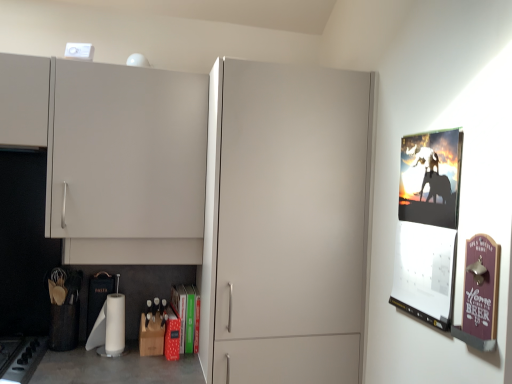
What is the approximate height of matte white cabinet at upper left?

matte white cabinet at upper left is 28.83 inches in height.

What do you see at coordinates (113, 156) in the screenshot? I see `matte white cabinet at upper left` at bounding box center [113, 156].

Identify the location of silhouette paper poster at right, acting as the second poster page starting from the front. The image size is (512, 384). (428, 225).

From the picture: What is the approximate height of silhouette paper poster at right, positioned as the 1th poster page in back-to-front order?

silhouette paper poster at right, positioned as the 1th poster page in back-to-front order, is 62.15 centimeters in height.

Looking at this image, measure the distance between white matte toilet paper at lower center and camera.

white matte toilet paper at lower center and camera are 1.78 meters apart from each other.

Locate an element on the screen. matte white cabinet at center is located at coordinates (289, 223).

From the picture: Considering the relative sizes of matte white cabinet at center and white matte toilet paper at lower center in the image provided, is matte white cabinet at center bigger than white matte toilet paper at lower center?

Yes, matte white cabinet at center is bigger than white matte toilet paper at lower center.

Based on the photo, which object is wider, matte white cabinet at center or white matte toilet paper at lower center?

Wider between the two is matte white cabinet at center.

Considering the positions of objects matte white cabinet at center and white matte toilet paper at lower center in the image provided, who is behind, matte white cabinet at center or white matte toilet paper at lower center?

white matte toilet paper at lower center is further away from the camera.

The width and height of the screenshot is (512, 384). In order to click on toilet paper directly beneath the matte white cabinet at center (from a real-world perspective) in this screenshot , I will do `click(109, 327)`.

From the image's perspective, which is above, purple wood sign at right, which is the second poster page from back to front, or matte white cabinet at upper left?

matte white cabinet at upper left is shown above in the image.

Between purple wood sign at right, which is the second poster page from back to front, and matte white cabinet at upper left, which one is positioned in front?

purple wood sign at right, which is the second poster page from back to front.

Looking at this image, which object is positioned more to the left, purple wood sign at right, which is the second poster page from back to front, or matte white cabinet at upper left?

From the viewer's perspective, matte white cabinet at upper left appears more on the left side.

Considering the sizes of objects purple wood sign at right, which is the second poster page from back to front, and matte white cabinet at upper left in the image provided, who is bigger, purple wood sign at right, which is the second poster page from back to front, or matte white cabinet at upper left?

Bigger between the two is matte white cabinet at upper left.

Is black matte gas stove at lower left closer to the viewer compared to silhouette paper poster at right, positioned as the 1th poster page in back-to-front order?

No, black matte gas stove at lower left is behind silhouette paper poster at right, positioned as the 1th poster page in back-to-front order.

Looking at their sizes, would you say black matte gas stove at lower left is wider or thinner than silhouette paper poster at right, acting as the second poster page starting from the front?

Clearly, black matte gas stove at lower left has more width compared to silhouette paper poster at right, acting as the second poster page starting from the front.

Looking at this image, considering the sizes of black matte gas stove at lower left and silhouette paper poster at right, positioned as the 1th poster page in back-to-front order, in the image, is black matte gas stove at lower left taller or shorter than silhouette paper poster at right, positioned as the 1th poster page in back-to-front order,?

Considering their sizes, black matte gas stove at lower left has less height than silhouette paper poster at right, positioned as the 1th poster page in back-to-front order.

Based on their positions, is black matte gas stove at lower left located to the left or right of silhouette paper poster at right, acting as the second poster page starting from the front?

From the image, it's evident that black matte gas stove at lower left is to the left of silhouette paper poster at right, acting as the second poster page starting from the front.

Can you tell me how much purple wood sign at right, the first poster page viewed from the front, and white matte toilet paper at lower center differ in facing direction?

The angular difference between purple wood sign at right, the first poster page viewed from the front, and white matte toilet paper at lower center is 88.7 degrees.

Is purple wood sign at right, which is the second poster page from back to front, turned away from white matte toilet paper at lower center?

No, white matte toilet paper at lower center is not at the back of purple wood sign at right, which is the second poster page from back to front.

From a real-world perspective, which object stands above the other?

From a 3D spatial view, purple wood sign at right, which is the second poster page from back to front, is above.

Which is more to the right, black matte gas stove at lower left or purple wood sign at right, which is the second poster page from back to front?

purple wood sign at right, which is the second poster page from back to front.

From a real-world perspective, which is physically above, black matte gas stove at lower left or purple wood sign at right, which is the second poster page from back to front?

purple wood sign at right, which is the second poster page from back to front, from a real-world perspective.

Which of these two, black matte gas stove at lower left or purple wood sign at right, the first poster page viewed from the front, stands taller?

purple wood sign at right, the first poster page viewed from the front, is taller.

This screenshot has width=512, height=384. I want to click on the 1st poster page above when counting from the black matte gas stove at lower left (from the image's perspective), so click(481, 287).

From a real-world perspective, relative to green matte book at lower center, is black matte gas stove at lower left vertically above or below?

black matte gas stove at lower left is situated lower than green matte book at lower center in the real world.

Is black matte gas stove at lower left facing towards green matte book at lower center?

No, black matte gas stove at lower left is not turned towards green matte book at lower center.

Which object is further away from the camera, black matte gas stove at lower left or green matte book at lower center?

green matte book at lower center is further from the camera.

Locate an element on the screen. This screenshot has height=384, width=512. magazine on the right of the black matte gas stove at lower left is located at coordinates (187, 316).

Is purple wood sign at right, the first poster page viewed from the front, bigger than matte white cabinet at center?

No.

Looking at this image, from the image's perspective, who appears lower, purple wood sign at right, the first poster page viewed from the front, or matte white cabinet at center?

matte white cabinet at center is shown below in the image.

Is matte white cabinet at center inside purple wood sign at right, the first poster page viewed from the front?

Definitely not — matte white cabinet at center is not inside purple wood sign at right, the first poster page viewed from the front.

In the image, there is a white matte toilet paper at lower center. What are the coordinates of `glass door above it (from the image's perspective)` in the screenshot? It's located at (289, 223).

Locate an element on the screen. This screenshot has height=384, width=512. cupboard on the left side of purple wood sign at right, the first poster page viewed from the front is located at coordinates (113, 156).

Which object lies nearer to the anchor point green matte book at lower center, white matte toilet paper at lower center or purple wood sign at right, which is the second poster page from back to front?

Based on the image, white matte toilet paper at lower center appears to be nearer to green matte book at lower center.

Which object lies nearer to the anchor point white matte toilet paper at lower center, black matte gas stove at lower left or matte white cabinet at center?

The object closer to white matte toilet paper at lower center is black matte gas stove at lower left.

Considering their positions, is silhouette paper poster at right, acting as the second poster page starting from the front, positioned closer to matte white cabinet at upper left than black matte gas stove at lower left?

The object closer to matte white cabinet at upper left is black matte gas stove at lower left.

Estimate the real-world distances between objects in this image. Which object is closer to green matte book at lower center, silhouette paper poster at right, positioned as the 1th poster page in back-to-front order, or white matte toilet paper at lower center?

Based on the image, white matte toilet paper at lower center appears to be nearer to green matte book at lower center.

Based on the photo, from the image, which object appears to be farther from black matte gas stove at lower left, purple wood sign at right, which is the second poster page from back to front, or white matte toilet paper at lower center?

purple wood sign at right, which is the second poster page from back to front, is further to black matte gas stove at lower left.

Based on the photo, based on their spatial positions, is white matte toilet paper at lower center or green matte book at lower center further from matte white cabinet at center?

Among the two, white matte toilet paper at lower center is located further to matte white cabinet at center.

Based on their spatial positions, is silhouette paper poster at right, positioned as the 1th poster page in back-to-front order, or matte white cabinet at center further from purple wood sign at right, which is the second poster page from back to front?

matte white cabinet at center is further to purple wood sign at right, which is the second poster page from back to front.

Based on their spatial positions, is matte white cabinet at upper left or white matte toilet paper at lower center further from green matte book at lower center?

Among the two, matte white cabinet at upper left is located further to green matte book at lower center.

Where is `toilet paper between matte white cabinet at upper left and purple wood sign at right, which is the second poster page from back to front`? toilet paper between matte white cabinet at upper left and purple wood sign at right, which is the second poster page from back to front is located at coordinates [109, 327].

The height and width of the screenshot is (384, 512). I want to click on magazine between white matte toilet paper at lower center and silhouette paper poster at right, positioned as the 1th poster page in back-to-front order, in the horizontal direction, so tap(187, 316).

You are a GUI agent. You are given a task and a screenshot of the screen. Output one action in this format:
    pyautogui.click(x=<x>, y=<y>)
    Task: Click on the toilet paper between black matte gas stove at lower left and green matte book at lower center from left to right
    The width and height of the screenshot is (512, 384).
    Given the screenshot: What is the action you would take?
    pyautogui.click(x=109, y=327)

The image size is (512, 384). I want to click on poster page between matte white cabinet at upper left and purple wood sign at right, the first poster page viewed from the front, in the horizontal direction, so click(x=428, y=225).